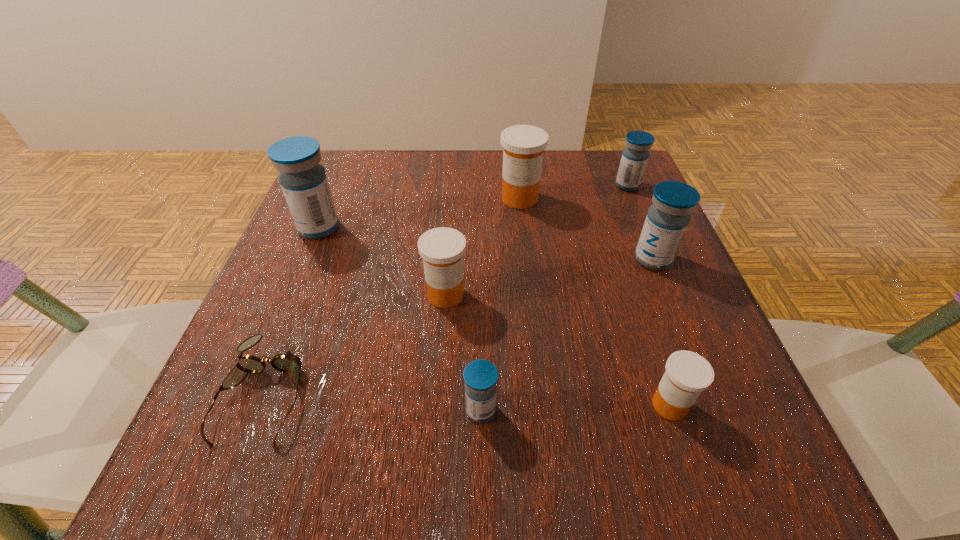
Identify the location of the sixth nearest object. This screenshot has height=540, width=960. (303, 180).

You are a GUI agent. You are given a task and a screenshot of the screen. Output one action in this format:
    pyautogui.click(x=<x>, y=<y>)
    Task: Click on the leftmost medicine
    The image size is (960, 540).
    Given the screenshot: What is the action you would take?
    pyautogui.click(x=303, y=180)

This screenshot has width=960, height=540. Find the location of `the second orange medicine from left to right`. the second orange medicine from left to right is located at coordinates (523, 145).

The image size is (960, 540). I want to click on the farthest orange medicine, so click(x=523, y=145).

Locate an element on the screen. This screenshot has height=540, width=960. the second nearest blue medicine is located at coordinates coord(668,217).

Where is `the second biggest blue medicine`? the second biggest blue medicine is located at coordinates (668, 217).

Where is `the sixth object from right to left`? Image resolution: width=960 pixels, height=540 pixels. the sixth object from right to left is located at coordinates (442, 249).

Where is `the fifth farthest object`? The width and height of the screenshot is (960, 540). the fifth farthest object is located at coordinates (442, 249).

Where is `the farthest blue medicine`? The width and height of the screenshot is (960, 540). the farthest blue medicine is located at coordinates (635, 155).

Image resolution: width=960 pixels, height=540 pixels. Identify the location of the fourth object from left to right. (480, 376).